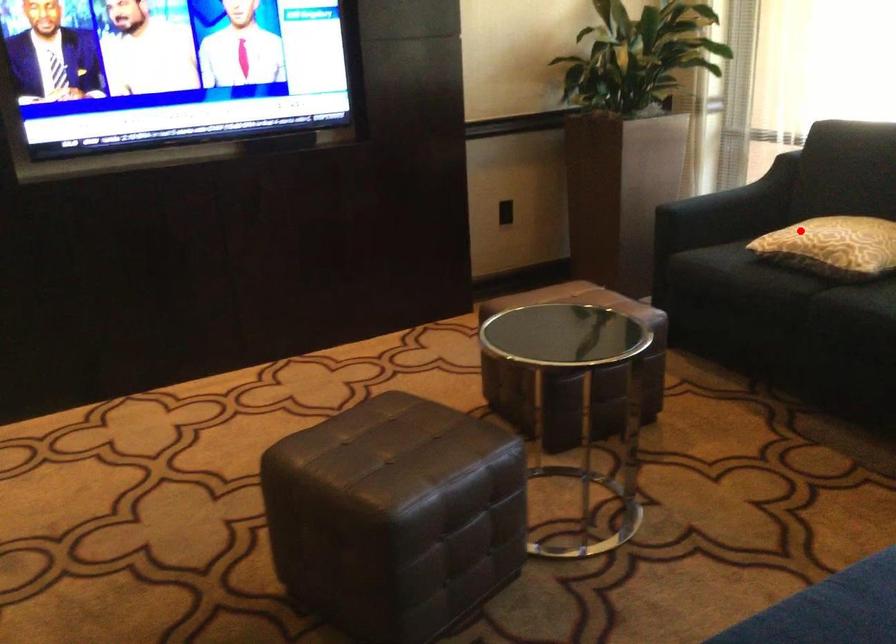
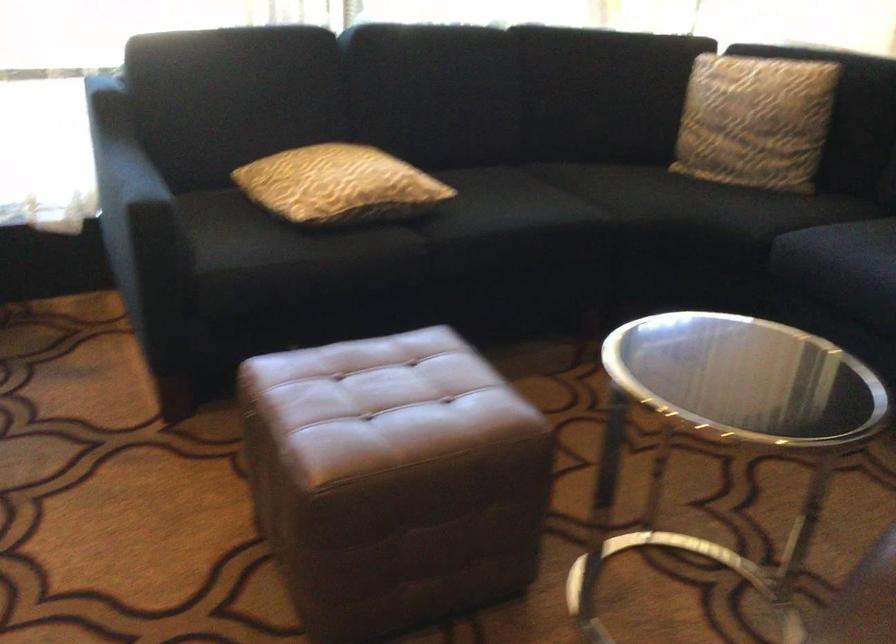
Question: I am providing you with two images of the same scene from different viewpoints. Image1 has a red point marked. In image2, the corresponding 3D location appears at what relative position? Reply with the corresponding letter.

Choices:
 (A) Closer
 (B) Farther

Answer: (A)